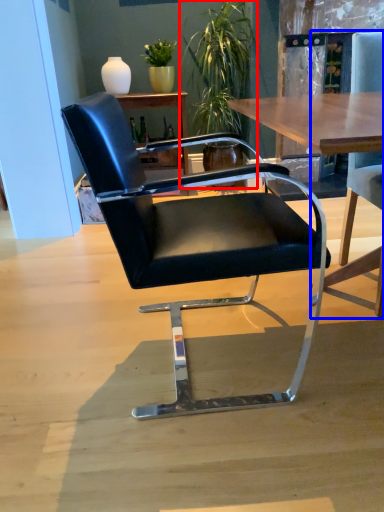
Question: Which object is further to the camera taking this photo, houseplant (highlighted by a red box) or chair (highlighted by a blue box)?

Choices:
 (A) houseplant
 (B) chair

Answer: (A)